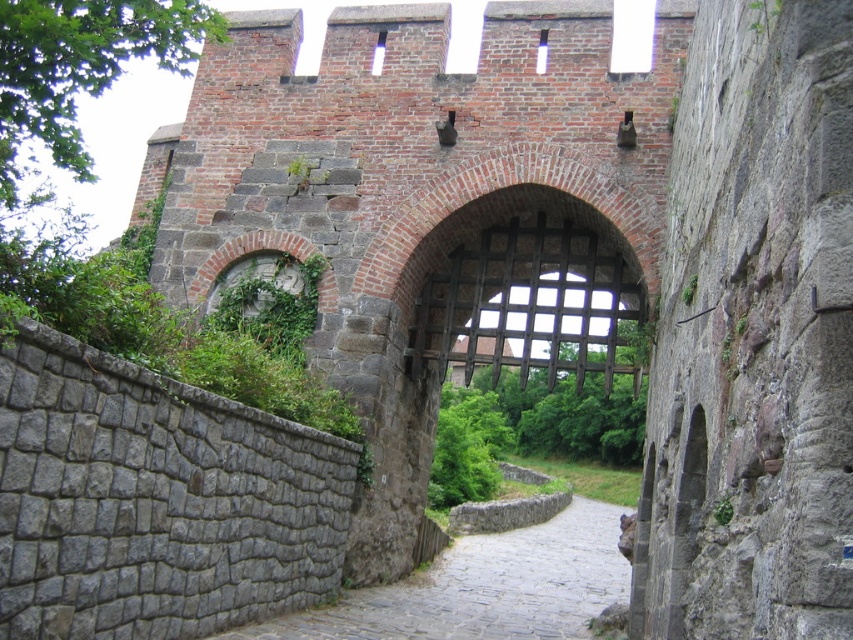
Where is `gray cobblestone path at center`? gray cobblestone path at center is located at coordinates (485, 588).

Is point (486, 540) behind point (381, 32)?

Yes, point (486, 540) is farther from viewer.

Between point (555, 531) and point (375, 56), which one is positioned in front?

Point (375, 56) is in front.

At what (x,y) coordinates should I click in order to perform the action: click on gray cobblestone path at center. Please return your answer as a coordinate pair (x, y). The width and height of the screenshot is (853, 640). Looking at the image, I should click on (485, 588).

Does point (602, 536) come closer to viewer compared to point (538, 33)?

No, (602, 536) is behind (538, 33).

Does gray cobblestone path at center have a smaller size compared to transparent glass window at center?

Actually, gray cobblestone path at center might be larger than transparent glass window at center.

Who is more forward, (555, 620) or (544, 35)?

Point (555, 620) is more forward.

The width and height of the screenshot is (853, 640). Find the location of `gray cobblestone path at center`. gray cobblestone path at center is located at coordinates (485, 588).

Is point (373, 54) positioned in front of point (541, 35)?

No, (373, 54) is further to viewer.

Is transparent glass window at upper center further to the viewer compared to transparent glass window at center?

Yes, it is behind transparent glass window at center.

Who is more distant from viewer, (x=373, y=64) or (x=543, y=52)?

The point (x=373, y=64) is more distant.

This screenshot has height=640, width=853. I want to click on transparent glass window at upper center, so click(378, 52).